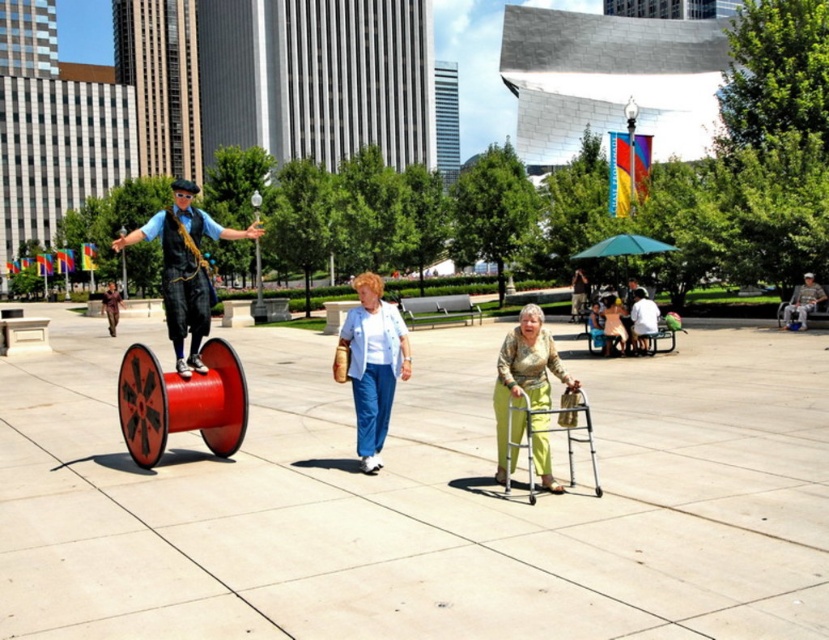
Question: Where is shiny red spool at center located in relation to matte white blouse at center in the image?

Choices:
 (A) right
 (B) left

Answer: (B)

Question: Among these objects, which one is nearest to the camera?

Choices:
 (A) shiny red spool at center
 (B) green textured pants at center
 (C) matte white blouse at center

Answer: (B)

Question: Does shiny red spool at center have a smaller size compared to matte white blouse at center?

Choices:
 (A) no
 (B) yes

Answer: (A)

Question: Does shiny red spool at center appear over matte white blouse at center?

Choices:
 (A) yes
 (B) no

Answer: (A)

Question: Which of these objects is positioned closest to the green textured pants at center?

Choices:
 (A) metal walker at lower center
 (B) shiny red spool at center
 (C) matte white blouse at center

Answer: (A)

Question: Which object is the farthest from the shiny red spool at center?

Choices:
 (A) metal walker at lower center
 (B) matte white blouse at center

Answer: (B)